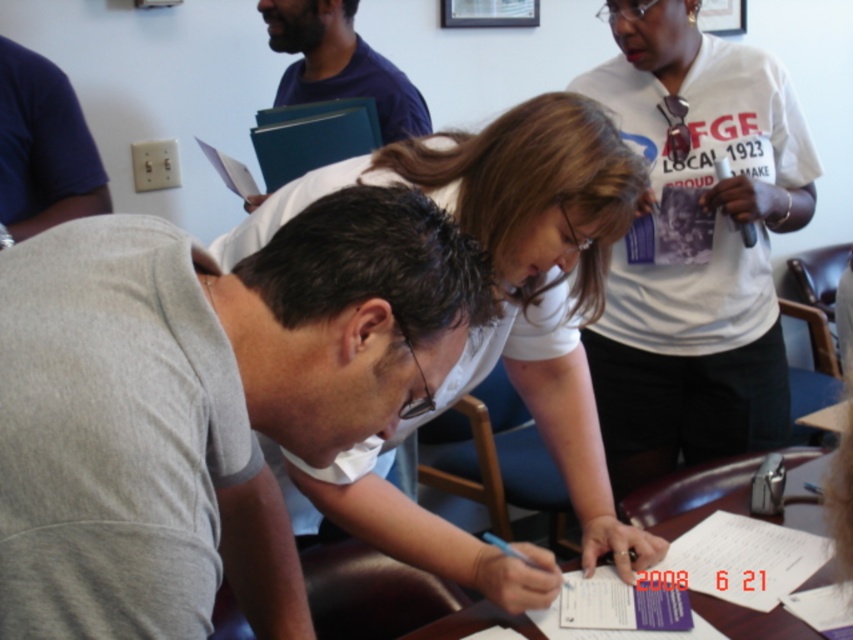
In the conference room scene, there are two people wearing glasses. One is the gray matte shirt at center and the other is the woman in white T shirt. Which of these two is closer to the point marked by coordinates point (196, 392)?

The gray matte shirt at center is represented by point (196, 392), so it is exactly at that point, making it the closest to the point marked by coordinates point (196, 392).